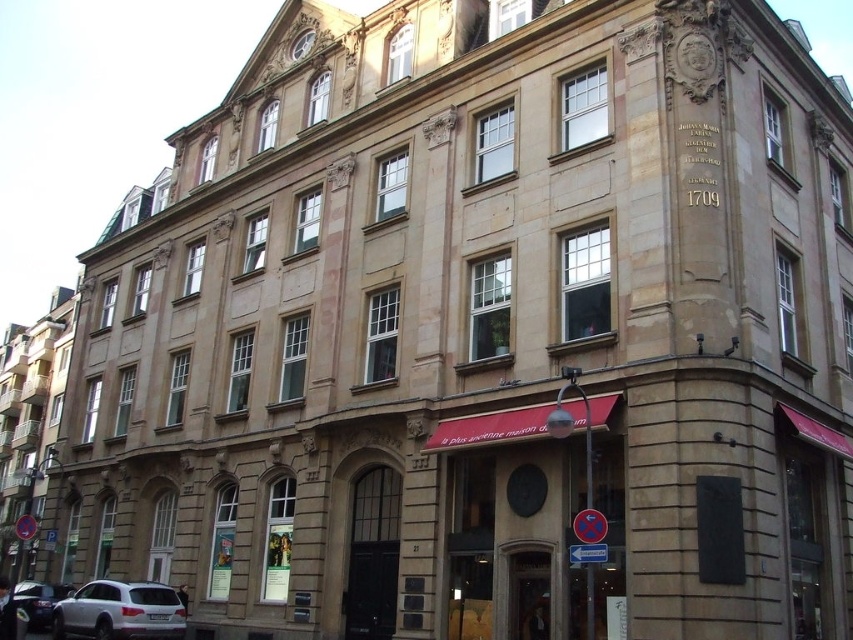
Question: Which of the following is the farthest from the observer?

Choices:
 (A) (108, 589)
 (B) (28, 602)

Answer: (B)

Question: Is white matte suv at lower left in front of shiny silver car at lower left?

Choices:
 (A) no
 (B) yes

Answer: (B)

Question: Is white matte suv at lower left bigger than shiny silver car at lower left?

Choices:
 (A) yes
 (B) no

Answer: (A)

Question: Which object appears closest to the camera in this image?

Choices:
 (A) shiny silver car at lower left
 (B) white matte suv at lower left

Answer: (B)

Question: Can you confirm if white matte suv at lower left is positioned to the left of shiny silver car at lower left?

Choices:
 (A) no
 (B) yes

Answer: (A)